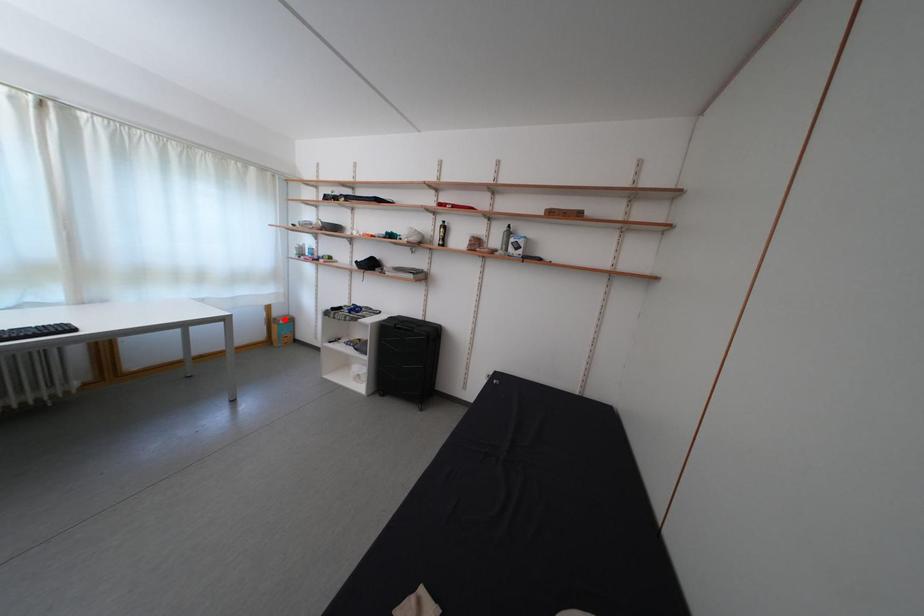
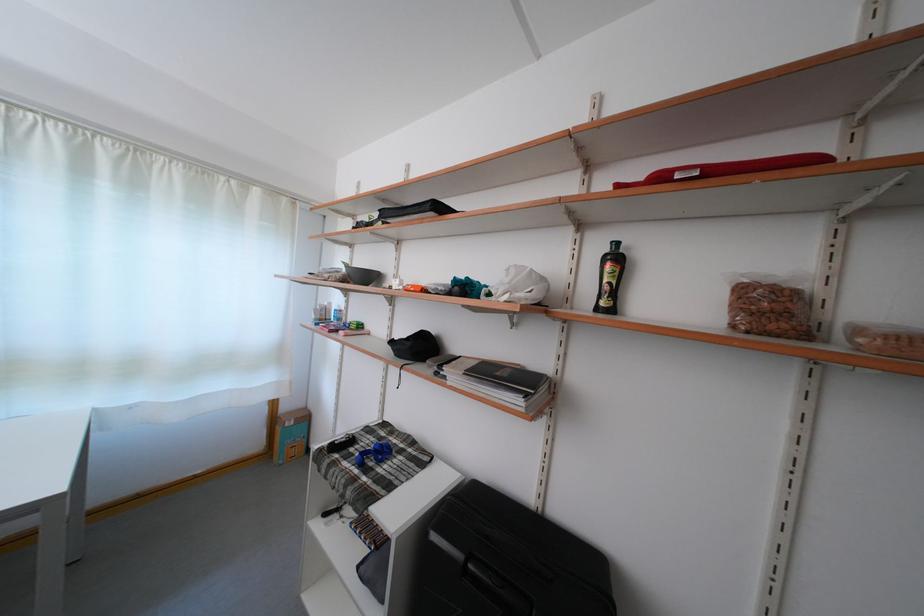
Where in the second image is the point corresponding to the highlighted location from the first image?

(293, 415)